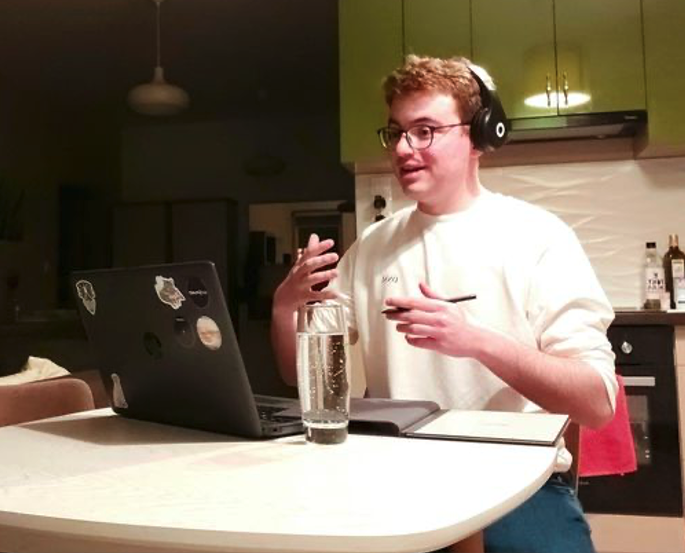
You are a GUI agent. You are given a task and a screenshot of the screen. Output one action in this format:
    pyautogui.click(x=<x>, y=<y>)
    Task: Click on the keyboard
    Image resolution: width=685 pixels, height=553 pixels.
    Given the screenshot: What is the action you would take?
    pyautogui.click(x=266, y=409)